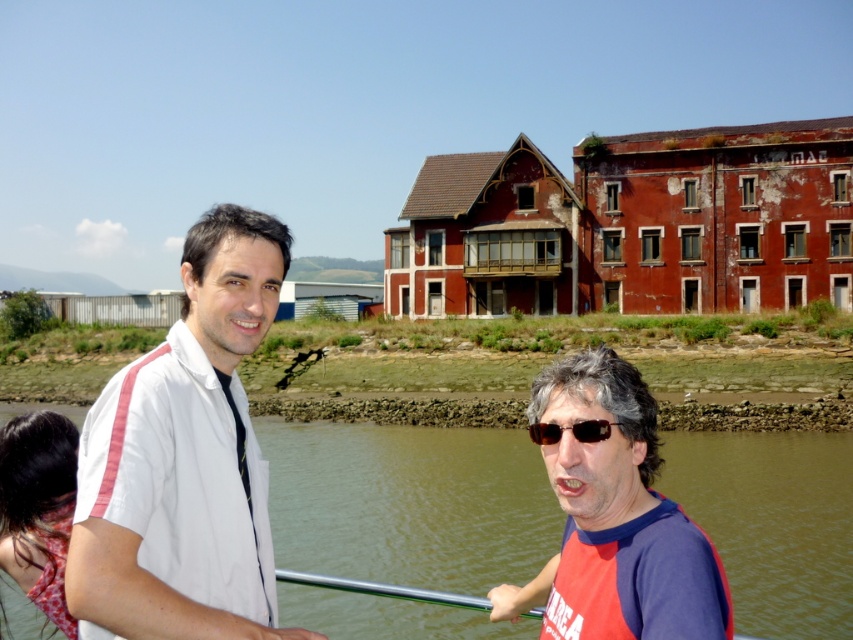
Who is lower down, white fabric shirt at left or red fabric shirt at center?

red fabric shirt at center is lower down.

Does white fabric shirt at left have a lesser height compared to red fabric shirt at center?

No, white fabric shirt at left is not shorter than red fabric shirt at center.

What are the coordinates of `white fabric shirt at left` in the screenshot? It's located at (184, 460).

Between red fabric shirt at center and black plastic sunglasses at lower center, which one is positioned lower?

red fabric shirt at center is lower down.

Can you confirm if red fabric shirt at center is positioned to the left of black plastic sunglasses at lower center?

In fact, red fabric shirt at center is to the right of black plastic sunglasses at lower center.

Does point (654, 496) lie behind point (529, 426)?

No, it is in front of (529, 426).

Locate an element on the screen. The width and height of the screenshot is (853, 640). red fabric shirt at center is located at coordinates (614, 520).

Does point (822, 486) come farther from viewer compared to point (160, 360)?

Yes, it is.

Which is above, brown water at lower center or white fabric shirt at left?

white fabric shirt at left is above.

Between point (793, 577) and point (160, 630), which one is positioned behind?

Point (793, 577)

This screenshot has height=640, width=853. I want to click on brown water at lower center, so click(408, 502).